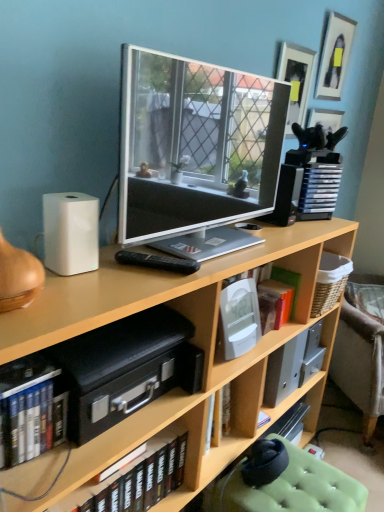
The width and height of the screenshot is (384, 512). In order to click on free spot to the right of white plastic speaker at right, which ranks as the first speaker in top-to-bottom order in this screenshot , I will do `click(313, 224)`.